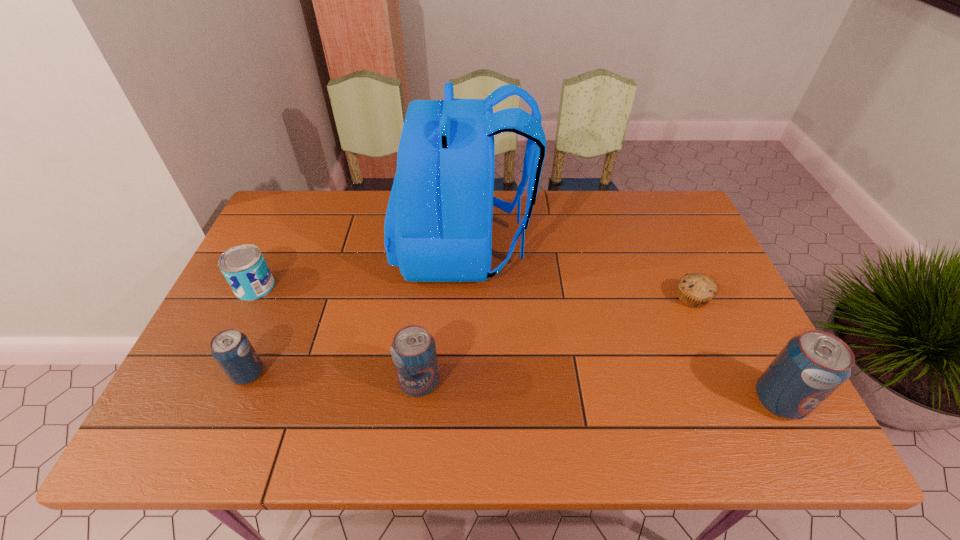
Point out which pop soda is positioned as the nearest to the second tallest object. Please provide its 2D coordinates. Your answer should be formatted as a tuple, i.e. [(x, y)], where the tuple contains the x and y coordinates of a point satisfying the conditions above.

[(413, 350)]

The width and height of the screenshot is (960, 540). Identify the location of vacant point that satisfies the following two spatial constraints: 1. on the back side of the muffin; 2. on the back of the tallest object. (669, 247).

Locate an element on the screen. Image resolution: width=960 pixels, height=540 pixels. vacant region that satisfies the following two spatial constraints: 1. on the back of the rightmost pop soda; 2. on the right side of the tallest object is located at coordinates (458, 400).

At what (x,y) coordinates should I click in order to perform the action: click on vacant space that satisfies the following two spatial constraints: 1. on the back of the second tallest object; 2. on the left side of the tallest object. Please return your answer as a coordinate pair (x, y). Looking at the image, I should click on (458, 400).

You are a GUI agent. You are given a task and a screenshot of the screen. Output one action in this format:
    pyautogui.click(x=<x>, y=<y>)
    Task: Click on the vacant space that satisfies the following two spatial constraints: 1. on the back of the muffin; 2. on the left side of the tallest object
    The height and width of the screenshot is (540, 960).
    Given the screenshot: What is the action you would take?
    pyautogui.click(x=462, y=298)